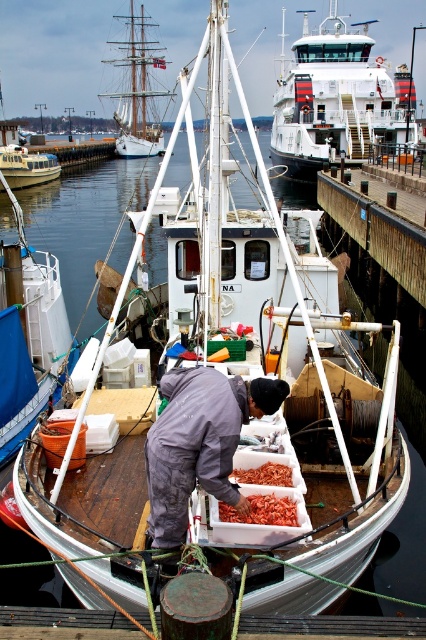
You are a crane operator trying to lift the orange dried shrimp at center without hitting the white plastic boat at center. Can you do it?

The white plastic boat at center is taller than orange dried shrimp at center, so the crane operator must ensure the hook does not collide with the boat while lifting the shrimp.

You are a visitor at the marina and notice two items on the boat deck. The gray fabric at center and the wooden planks at lower center. Which one is larger in size?

The gray fabric at center is bigger than wooden planks at lower center.